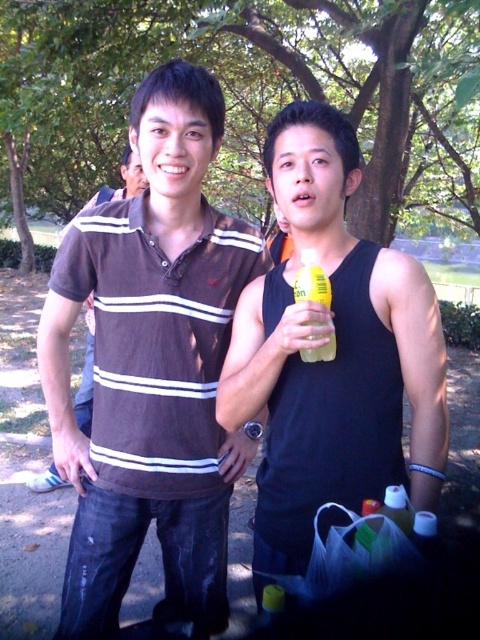
Question: Can you confirm if brown striped polo shirt at center is thinner than black matte tank top at center?

Choices:
 (A) no
 (B) yes

Answer: (A)

Question: Which of the following is the closest to the observer?

Choices:
 (A) (74, 410)
 (B) (144, 321)
 (C) (323, 371)
 (D) (316, 268)

Answer: (D)

Question: Can you confirm if brown striped polo shirt at center is positioned to the right of yellow plastic bottle at center?

Choices:
 (A) yes
 (B) no

Answer: (B)

Question: From the image, what is the correct spatial relationship of brown striped polo shirt at center in relation to black matte tank top at center?

Choices:
 (A) below
 (B) above

Answer: (A)

Question: Which object is farther from the camera taking this photo?

Choices:
 (A) brown striped polo shirt at center
 (B) brown striped shirt at center
 (C) black matte tank top at center
 (D) yellow plastic bottle at center

Answer: (B)

Question: Which point appears closest to the camera in this image?

Choices:
 (A) (52, 348)
 (B) (321, 356)

Answer: (B)